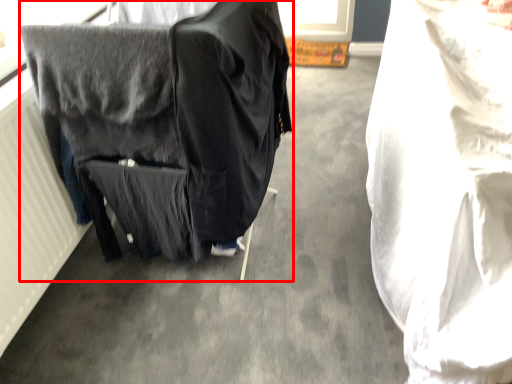
Question: From the image's perspective, considering the relative positions of furniture (annotated by the red box) and sheet in the image provided, where is furniture (annotated by the red box) located with respect to the staircase?

Choices:
 (A) below
 (B) above

Answer: (B)